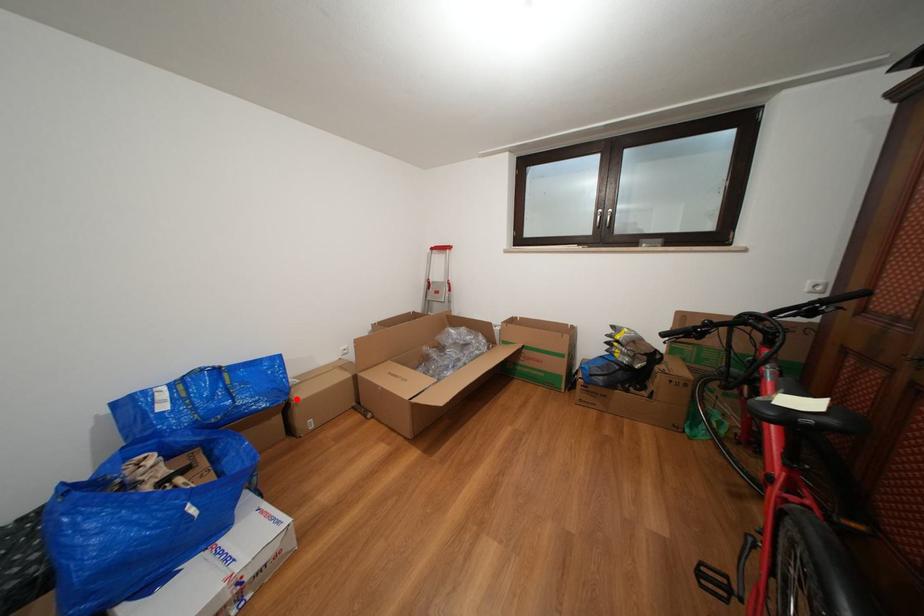
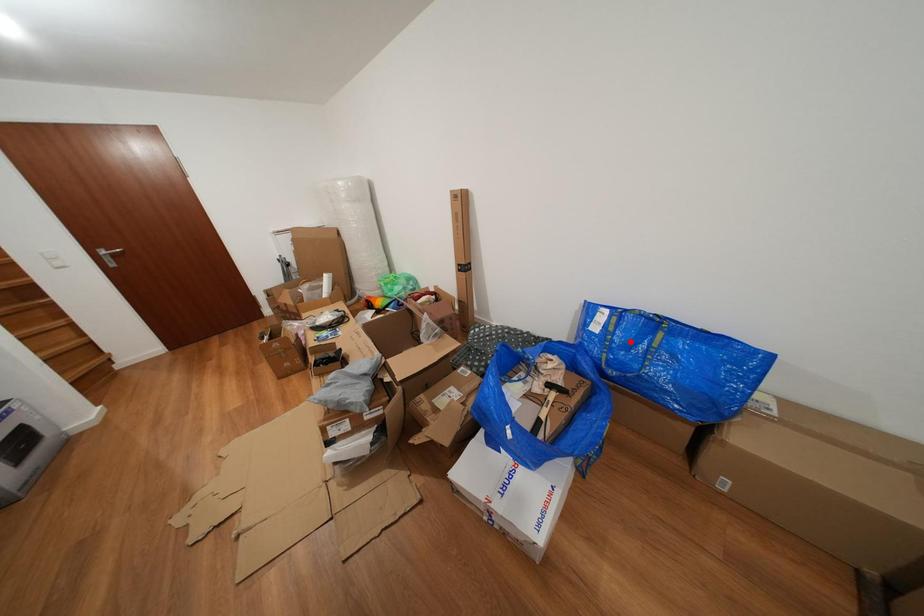
I am providing you with two images of the same scene from different viewpoints. A red point is marked on the first image and another point is marked on the second image. Is the red point in image1 aligned with the point shown in image2?

No